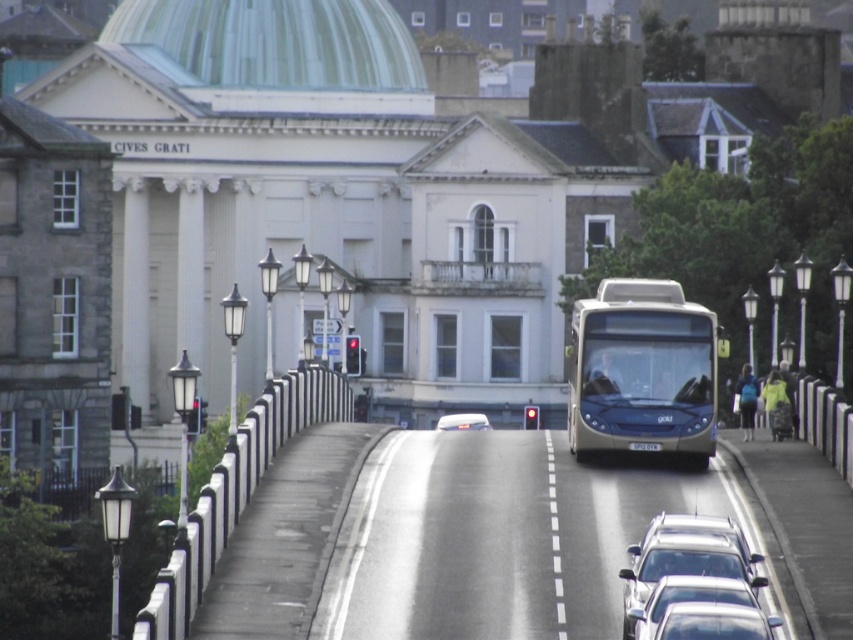
Question: Is silver metallic car at lower center smaller than white plastic license plate at center?

Choices:
 (A) yes
 (B) no

Answer: (A)

Question: Among these points, which one is nearest to the camera?

Choices:
 (A) [x=744, y=564]
 (B) [x=641, y=445]

Answer: (A)

Question: Which object is positioned farthest from the metallic silver car at center?

Choices:
 (A) silver metallic car at lower center
 (B) white plastic license plate at center

Answer: (A)

Question: Which object appears farthest from the camera in this image?

Choices:
 (A) metallic silver bus at center
 (B) white plastic license plate at center
 (C) shiny silver car at center
 (D) metallic silver car at center

Answer: (D)

Question: Does shiny silver car at center have a smaller size compared to metallic silver car at center?

Choices:
 (A) yes
 (B) no

Answer: (A)

Question: Can you confirm if shiny silver car at center is positioned above white plastic license plate at center?

Choices:
 (A) no
 (B) yes

Answer: (A)